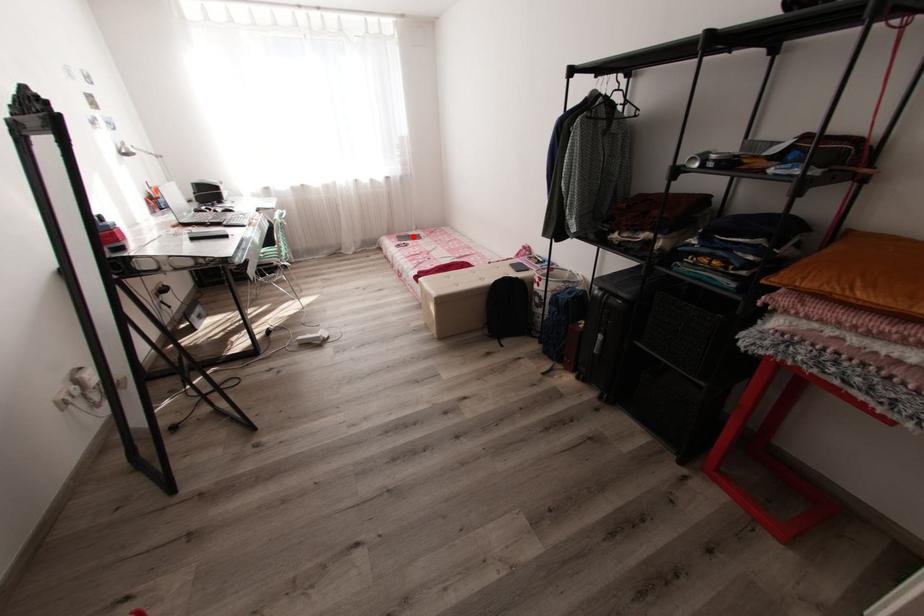
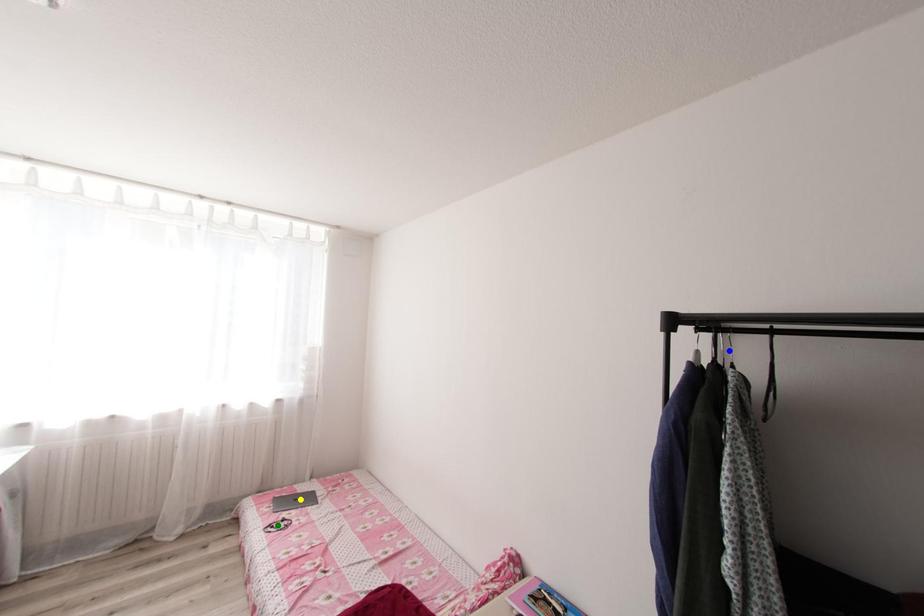
Question: I am providing you with two images of the same scene from different viewpoints. A red point is marked on the first image. You are given multiple points on the second image. Which mark in image 2 goes with the point in image 1?

Choices:
 (A) green point
 (B) yellow point
 (C) blue point

Answer: (B)